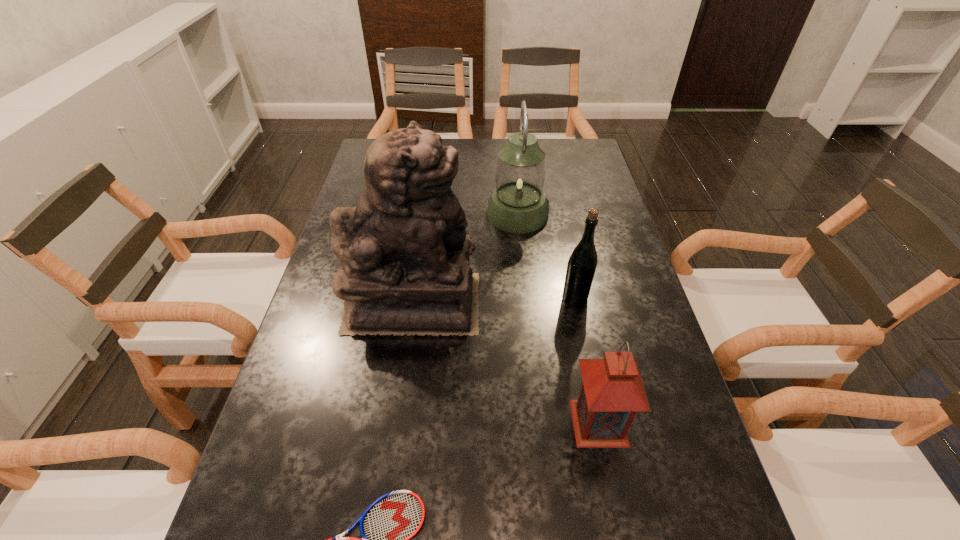
This screenshot has width=960, height=540. In order to click on object present at the left edge in this screenshot , I will do `click(404, 254)`.

This screenshot has width=960, height=540. I want to click on beer bottle that is positioned at the right edge, so click(582, 263).

Image resolution: width=960 pixels, height=540 pixels. Identify the location of lantern situated at the right edge. (612, 392).

Locate an element on the screen. free space at the far edge of the desktop is located at coordinates click(481, 139).

The width and height of the screenshot is (960, 540). In the image, there is a desktop. Find the location of `vacant space at the left edge`. vacant space at the left edge is located at coordinates (341, 362).

Locate an element on the screen. The image size is (960, 540). vacant region at the far left corner of the desktop is located at coordinates (368, 150).

The width and height of the screenshot is (960, 540). Identify the location of vacant space at the far right corner of the desktop. (564, 151).

Locate an element on the screen. This screenshot has height=540, width=960. free space between the sculpture and the shorter lantern is located at coordinates (506, 362).

Identify the location of empty space between the shorter lantern and the farthest object. (558, 318).

Locate an element on the screen. The height and width of the screenshot is (540, 960). free space between the tallest object and the shorter lantern is located at coordinates (506, 362).